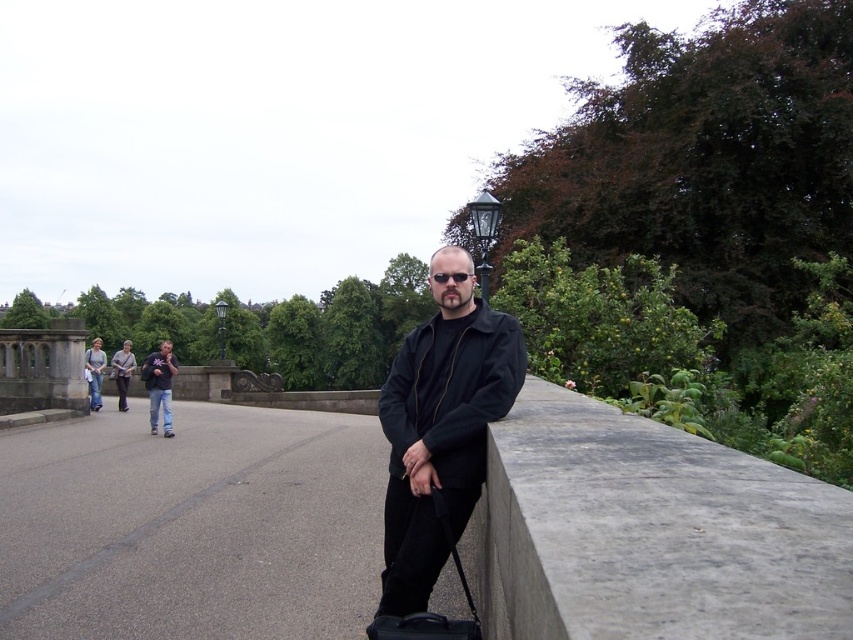
Question: Which of the following is the closest to the observer?

Choices:
 (A) dark gray jacket at center
 (B) black matte jacket at center
 (C) gray concrete ledge at right
 (D) dark blue jeans at left

Answer: (C)

Question: Does black matte jacket at center appear over dark gray jacket at center?

Choices:
 (A) yes
 (B) no

Answer: (A)

Question: Does gray concrete ledge at right have a greater width compared to dark blue jeans at left?

Choices:
 (A) yes
 (B) no

Answer: (B)

Question: Can you confirm if black matte jacket at center is positioned to the right of dark gray jacket at center?

Choices:
 (A) yes
 (B) no

Answer: (A)

Question: Estimate the real-world distances between objects in this image. Which object is farther from the dark blue jeans at left?

Choices:
 (A) gray concrete ledge at right
 (B) black matte jacket at center
 (C) dark gray jacket at center

Answer: (B)

Question: Among these objects, which one is farthest from the camera?

Choices:
 (A) dark blue jeans at left
 (B) dark gray jacket at center
 (C) black matte jacket at center

Answer: (B)